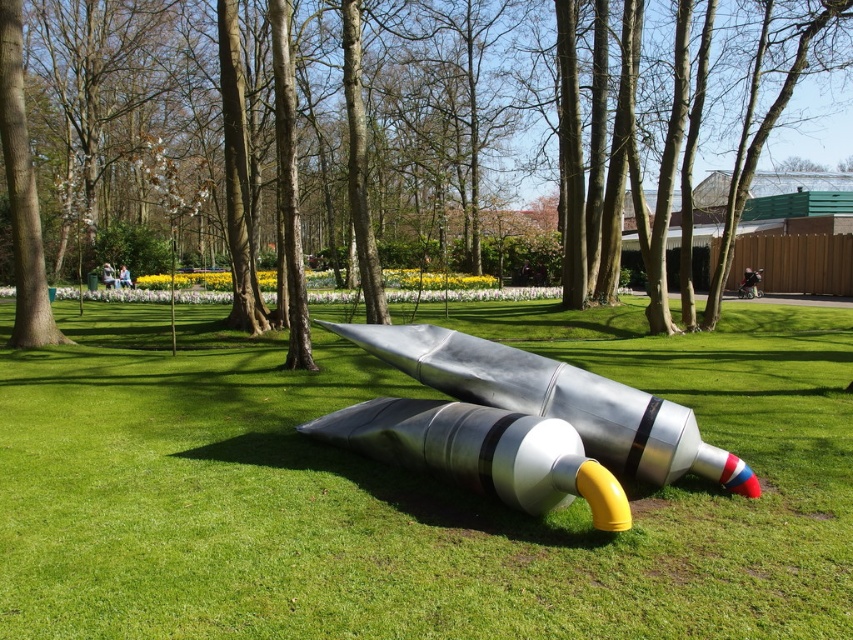
Can you confirm if brushed metal tree at center is positioned above polished metallic rocket at center?

Correct, brushed metal tree at center is located above polished metallic rocket at center.

Locate an element on the screen. The image size is (853, 640). brushed metal tree at center is located at coordinates (328, 145).

At what (x,y) coordinates should I click in order to perform the action: click on metallic grass at center. Please return your answer as a coordinate pair (x, y). The height and width of the screenshot is (640, 853). Looking at the image, I should click on (408, 488).

Which is behind, point (254, 422) or point (570, 381)?

Positioned behind is point (254, 422).

Identify the location of metallic grass at center. (408, 488).

Between metallic grass at center and brushed metal tree at center, which one appears on the left side from the viewer's perspective?

Positioned to the left is brushed metal tree at center.

Who is higher up, metallic grass at center or brushed metal tree at center?

Positioned higher is brushed metal tree at center.

Measure the distance between point (270, 362) and camera.

They are 33.25 feet apart.

This screenshot has width=853, height=640. I want to click on metallic grass at center, so click(408, 488).